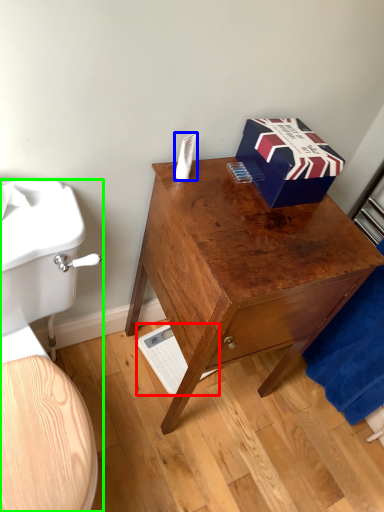
Question: Estimate the real-world distances between objects in this image. Which object is farther from scale (highlighted by a red box), toilet paper (highlighted by a blue box) or toilet (highlighted by a green box)?

Choices:
 (A) toilet paper
 (B) toilet

Answer: (A)